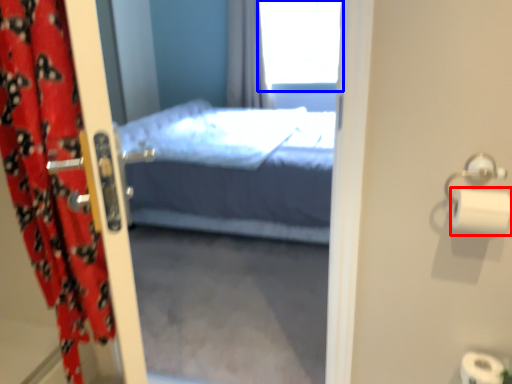
Question: Which of the following is the closest to the observer, toilet paper (highlighted by a red box) or window (highlighted by a blue box)?

Choices:
 (A) toilet paper
 (B) window

Answer: (A)